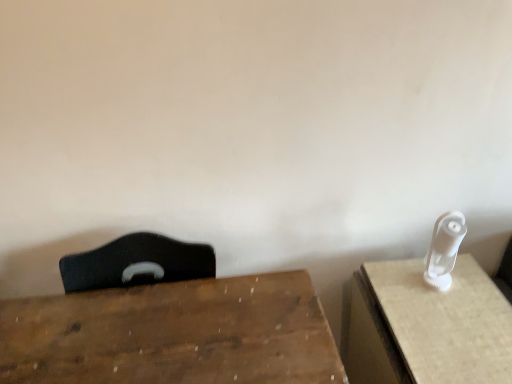
Question: Is white plastic wii controller at right a part of wooden table at center, which ranks as the 1th table in left-to-right order?

Choices:
 (A) yes
 (B) no

Answer: (B)

Question: Can you confirm if wooden table at center, which ranks as the 1th table in left-to-right order, is positioned to the right of white plastic wii controller at right?

Choices:
 (A) yes
 (B) no

Answer: (B)

Question: Can you confirm if wooden table at center, the 2th table positioned from the right, is bigger than white plastic wii controller at right?

Choices:
 (A) yes
 (B) no

Answer: (A)

Question: Is wooden table at center, the 2th table positioned from the right, next to white plastic wii controller at right and touching it?

Choices:
 (A) yes
 (B) no

Answer: (B)

Question: Is wooden table at center, the 2th table positioned from the right, positioned with its back to white plastic wii controller at right?

Choices:
 (A) yes
 (B) no

Answer: (B)

Question: From a real-world perspective, does wooden table at center, the 2th table positioned from the right, stand above white plastic wii controller at right?

Choices:
 (A) yes
 (B) no

Answer: (B)

Question: Is white plastic toothbrush at right, placed as the 1th table when sorted from right to left, closer to camera compared to white plastic wii controller at right?

Choices:
 (A) no
 (B) yes

Answer: (B)

Question: From a real-world perspective, does white plastic toothbrush at right, placed as the 1th table when sorted from right to left, sit lower than white plastic wii controller at right?

Choices:
 (A) yes
 (B) no

Answer: (A)

Question: Considering the relative positions of white plastic toothbrush at right, which appears as the second table when viewed from the left, and white plastic wii controller at right in the image provided, is white plastic toothbrush at right, which appears as the second table when viewed from the left, to the left of white plastic wii controller at right from the viewer's perspective?

Choices:
 (A) yes
 (B) no

Answer: (B)

Question: Is white plastic toothbrush at right, placed as the 1th table when sorted from right to left, wider than white plastic wii controller at right?

Choices:
 (A) no
 (B) yes

Answer: (B)

Question: Is the surface of white plastic toothbrush at right, which appears as the second table when viewed from the left, in direct contact with white plastic wii controller at right?

Choices:
 (A) no
 (B) yes

Answer: (A)

Question: Is there a large distance between white plastic toothbrush at right, placed as the 1th table when sorted from right to left, and white plastic wii controller at right?

Choices:
 (A) yes
 (B) no

Answer: (B)

Question: Is wooden table at center, which ranks as the 1th table in left-to-right order, outside of white plastic toothbrush at right, placed as the 1th table when sorted from right to left?

Choices:
 (A) no
 (B) yes

Answer: (B)